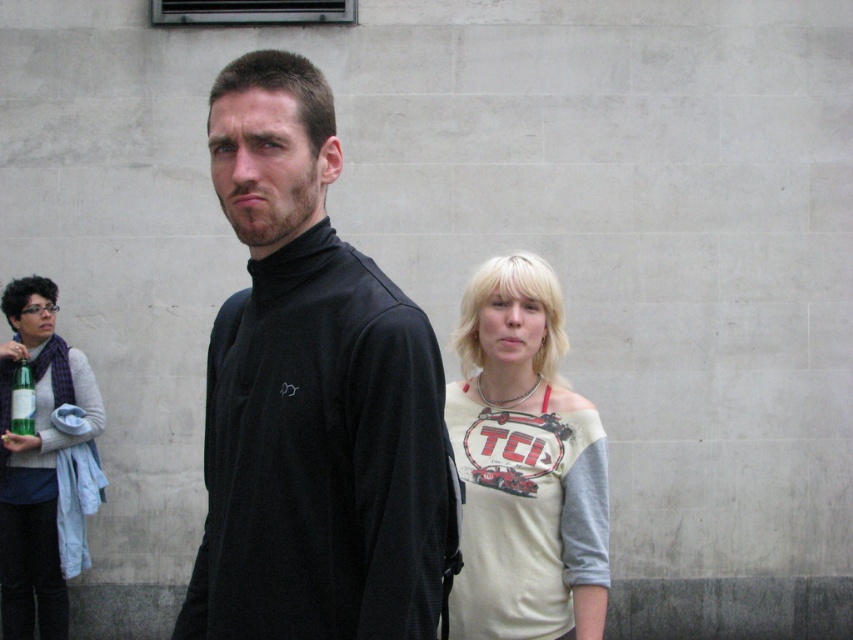
You are a fashion designer observing the image. You need to decide which garment has a wider silhouette between the black matte turtleneck at center and the matte gray sweater at left. Based on the scene description, which one is wider?

The black matte turtleneck at center has a wider silhouette than the matte gray sweater at left as its width surpasses the latter.

You are a photographer setting up for a group photo. You need to position the white matte shirt at center and the green glass bottle at left in such a way that both are clearly visible. Given their current positions, which object is closer to the camera and might block the other?

The white matte shirt at center is closer to the viewer than the green glass bottle at left, so it might block the green glass bottle at left if not adjusted properly.

You are organizing a small event and need to place a 12 cm wide name tag on a surface. Given the objects present, which one can accommodate the name tag without overlapping? Consider the width of the matte gray sweater at left and the green glass bottle at left.

The matte gray sweater at left has a greater width than the green glass bottle at left according to the description. Since the name tag is 12 cm wide, the matte gray sweater at left is wider and can accommodate the name tag without overlapping.